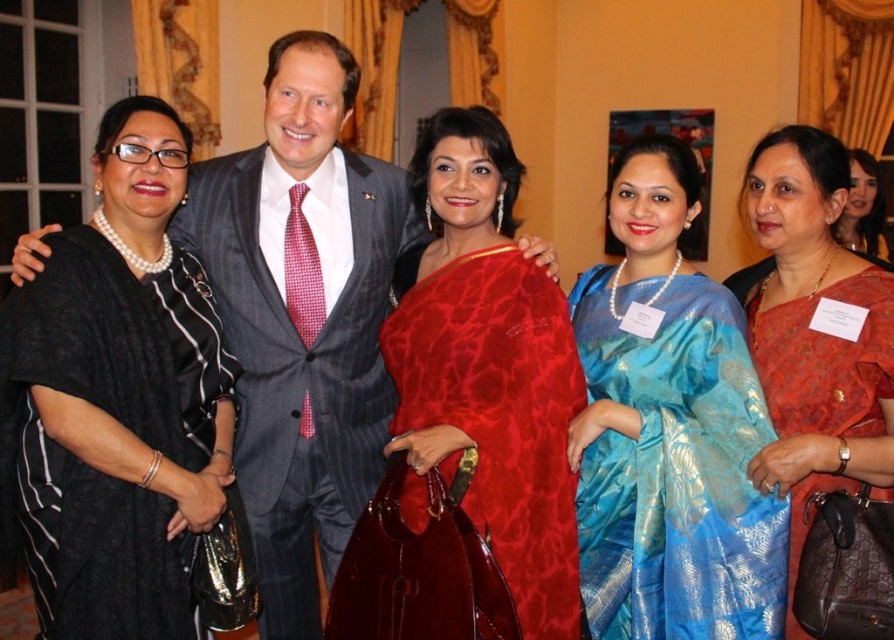
Is matte gray suit at center thinner than matte red sari at center?

Incorrect, matte gray suit at center's width is not less than matte red sari at center's.

Who is more forward, (283, 624) or (848, 412)?

Point (848, 412) is more forward.

Describe the element at coordinates (302, 317) in the screenshot. Image resolution: width=894 pixels, height=640 pixels. I see `matte gray suit at center` at that location.

You are a GUI agent. You are given a task and a screenshot of the screen. Output one action in this format:
    pyautogui.click(x=<x>, y=<y>)
    Task: Click on the matte gray suit at center
    The height and width of the screenshot is (640, 894).
    Given the screenshot: What is the action you would take?
    pyautogui.click(x=302, y=317)

Which is behind, point (643, 214) or point (884, 483)?

Positioned behind is point (643, 214).

Between blue silk saree at center and matte red sari at center, which one has more height?

Standing taller between the two is blue silk saree at center.

Between point (608, 417) and point (849, 476), which one is positioned behind?

The point (608, 417) is behind.

This screenshot has width=894, height=640. Identify the location of blue silk saree at center. (669, 429).

Measure the distance between red silk saree at center and camera.

They are 6.68 feet apart.

Can you confirm if red silk saree at center is taller than matte red sari at center?

Yes.

Describe the element at coordinates (488, 365) in the screenshot. The width and height of the screenshot is (894, 640). I see `red silk saree at center` at that location.

Locate an element on the screen. The width and height of the screenshot is (894, 640). red silk saree at center is located at coordinates point(488,365).